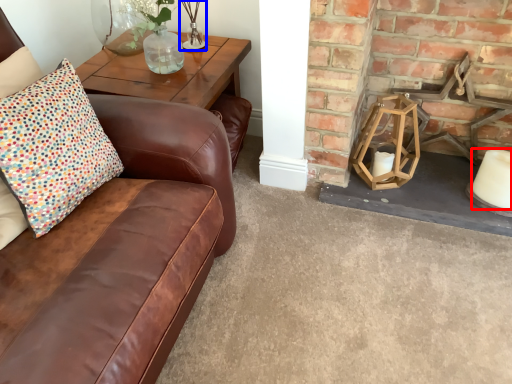
Question: Which point is closer to the camera, candle (highlighted by a red box) or candle holder (highlighted by a blue box)?

Choices:
 (A) candle
 (B) candle holder

Answer: (A)